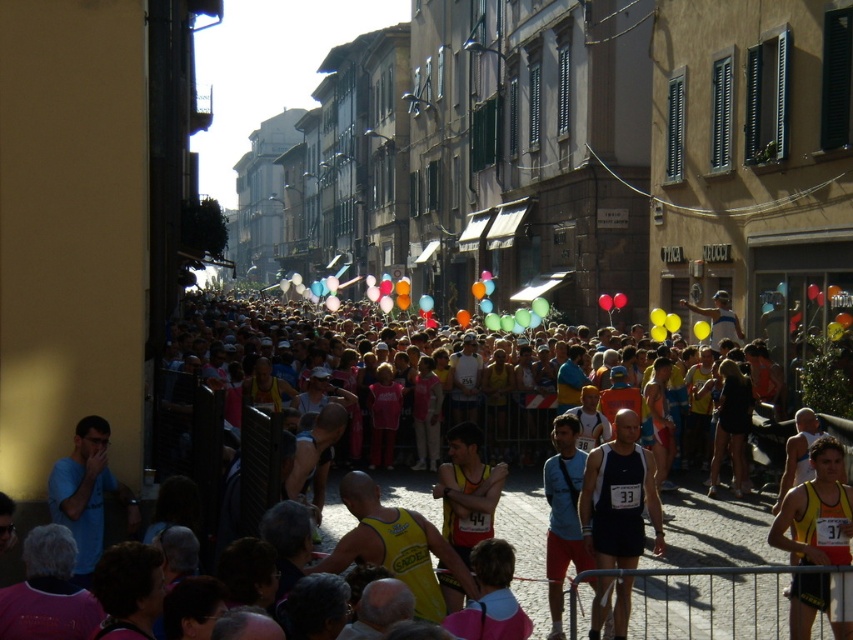
Can you confirm if dark blue athletic tank top at center is smaller than yellow fabric tank top at center?

Yes, dark blue athletic tank top at center is smaller than yellow fabric tank top at center.

Does dark blue athletic tank top at center appear over yellow fabric tank top at center?

Indeed, dark blue athletic tank top at center is positioned over yellow fabric tank top at center.

Is point (633, 548) positioned behind point (833, 480)?

Yes, it is.

The image size is (853, 640). Find the location of `dark blue athletic tank top at center`. dark blue athletic tank top at center is located at coordinates (619, 497).